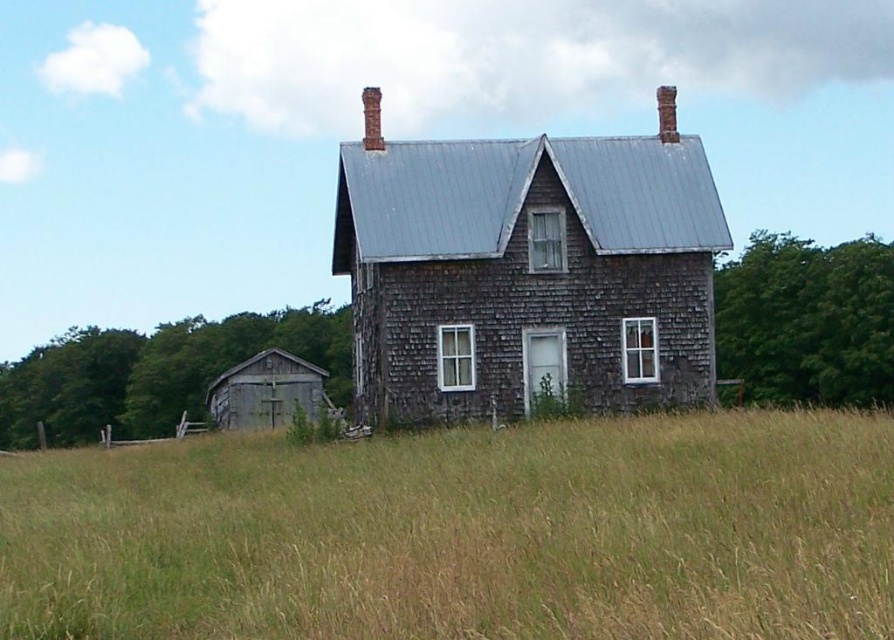
Question: Can you confirm if brown grassy field at center is wider than weathered wood barn at lower left?

Choices:
 (A) no
 (B) yes

Answer: (B)

Question: Which object is farther from the camera taking this photo?

Choices:
 (A) weathered wood barn at center
 (B) weathered wood barn at lower left

Answer: (A)

Question: Which object is the farthest from the weathered wood barn at lower left?

Choices:
 (A) weathered wood barn at center
 (B) brown grassy field at center

Answer: (B)

Question: Can you confirm if brown grassy field at center is wider than weathered wood barn at center?

Choices:
 (A) no
 (B) yes

Answer: (B)

Question: Can you confirm if brown grassy field at center is wider than weathered wood barn at lower left?

Choices:
 (A) yes
 (B) no

Answer: (A)

Question: Which object is closer to the camera taking this photo?

Choices:
 (A) weathered wood barn at center
 (B) weathered wood barn at lower left
 (C) brown grassy field at center

Answer: (C)